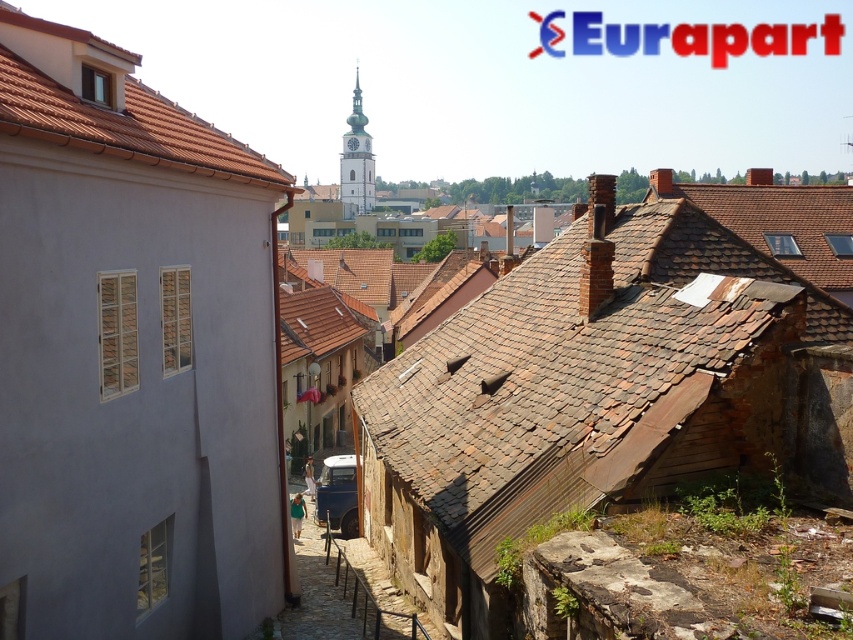
How much distance is there between brown shingles at center and brown tiled roof at upper left?

brown shingles at center is 7.50 meters from brown tiled roof at upper left.

Between point (592, 316) and point (24, 81), which one is positioned in front?

Point (24, 81)

This screenshot has width=853, height=640. In order to click on brown shingles at center in this screenshot , I will do `click(585, 380)`.

Between brown shingles at center and smooth stone wall at center, which one is positioned higher?

brown shingles at center

Can you confirm if brown shingles at center is shorter than smooth stone wall at center?

No, brown shingles at center is not shorter than smooth stone wall at center.

At what (x,y) coordinates should I click in order to perform the action: click on brown shingles at center. Please return your answer as a coordinate pair (x, y). The width and height of the screenshot is (853, 640). Looking at the image, I should click on (585, 380).

Locate an element on the screen. The height and width of the screenshot is (640, 853). brown shingles at center is located at coordinates (585, 380).

Can you confirm if brown tiled roof at upper left is wider than smooth stone wall at center?

Indeed, brown tiled roof at upper left has a greater width compared to smooth stone wall at center.

Does point (27, 42) lie behind point (308, 568)?

No, it is not.

Is point (180, 154) closer to viewer compared to point (398, 621)?

That is True.

You are a GUI agent. You are given a task and a screenshot of the screen. Output one action in this format:
    pyautogui.click(x=<x>, y=<y>)
    Task: Click on the brown tiled roof at upper left
    Image resolution: width=853 pixels, height=640 pixels.
    Given the screenshot: What is the action you would take?
    coord(107,104)